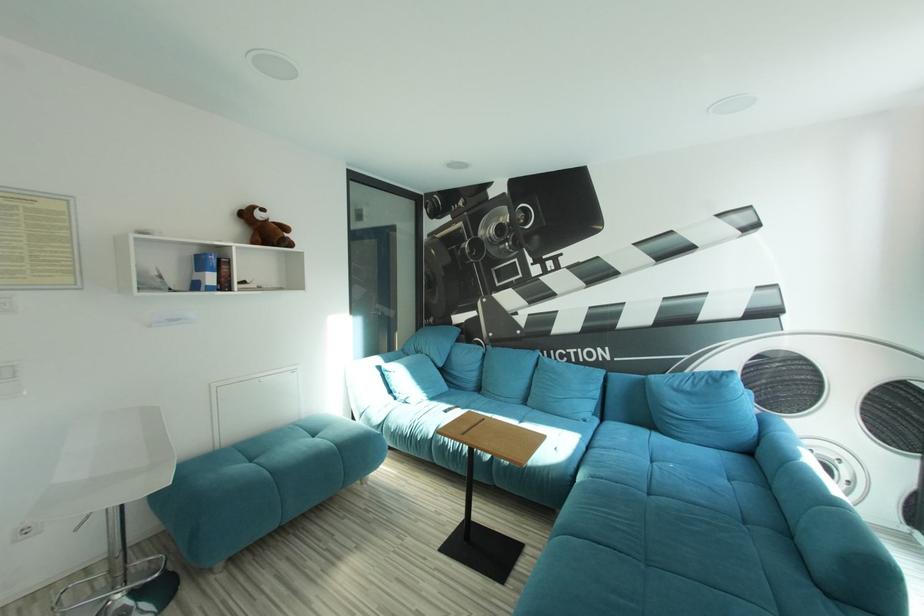
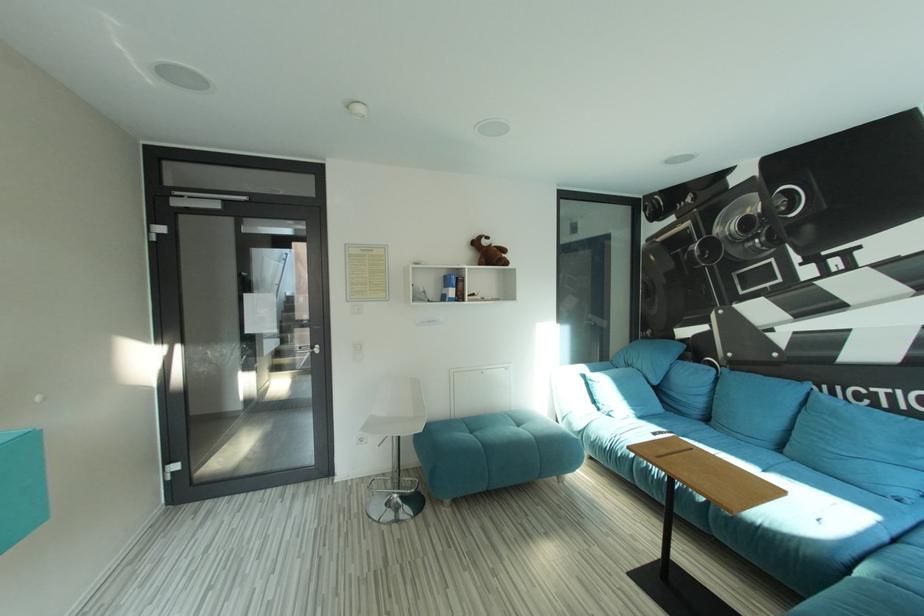
Question: Based on the continuous images, in which direction is the camera rotating? Reply with the corresponding letter.

Choices:
 (A) Left
 (B) Right
 (C) Up
 (D) Down

Answer: (A)